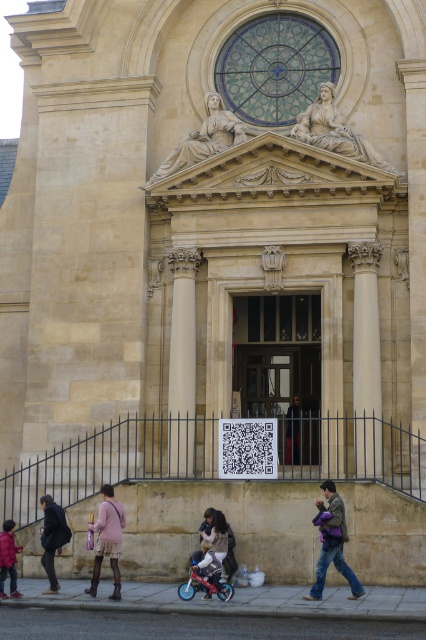
Describe the element at coordinates (365, 358) in the screenshot. Image resolution: width=426 pixels, height=640 pixels. I see `smooth stone column at center` at that location.

Between smooth stone column at center and dark brown leather jacket at center, which one is positioned higher?

smooth stone column at center

Describe the element at coordinates (365, 358) in the screenshot. I see `smooth stone column at center` at that location.

Where is `smooth stone column at center`? smooth stone column at center is located at coordinates (365, 358).

Is pink fabric skirt at lower left below metallic blue baby carriage at lower center?

Actually, pink fabric skirt at lower left is above metallic blue baby carriage at lower center.

Between point (97, 570) and point (232, 595), which one is positioned in front?

Positioned in front is point (232, 595).

Does point (112, 541) come closer to viewer compared to point (186, 588)?

No, (112, 541) is behind (186, 588).

Locate an element on the screen. pink fabric skirt at lower left is located at coordinates (108, 540).

Between point (118, 589) and point (46, 566), which one is positioned behind?

Point (46, 566)

The width and height of the screenshot is (426, 640). Describe the element at coordinates (108, 540) in the screenshot. I see `pink fabric skirt at lower left` at that location.

You are a GUI agent. You are given a task and a screenshot of the screen. Output one action in this format:
    pyautogui.click(x=<x>, y=<y>)
    Task: Click on the pink fabric skirt at lower left
    This screenshot has width=426, height=640.
    Given the screenshot: What is the action you would take?
    pyautogui.click(x=108, y=540)